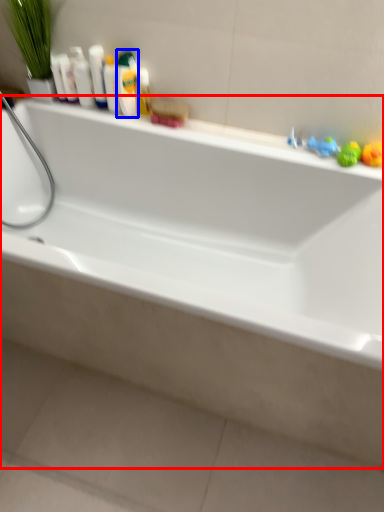
Question: Which point is further to the camera, bathtub (highlighted by a red box) or mouthwash (highlighted by a blue box)?

Choices:
 (A) bathtub
 (B) mouthwash

Answer: (B)